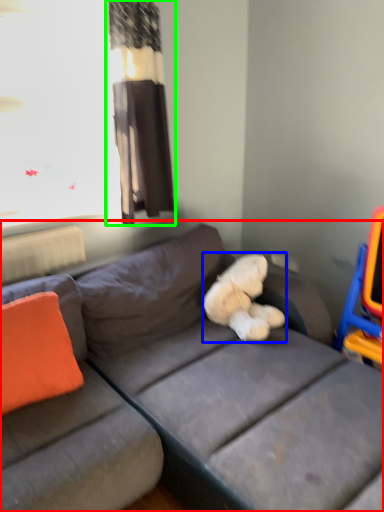
Question: Which is farther away from studio couch (highlighted by a red box)? teddy (highlighted by a blue box) or curtain (highlighted by a green box)?

Choices:
 (A) teddy
 (B) curtain

Answer: (B)